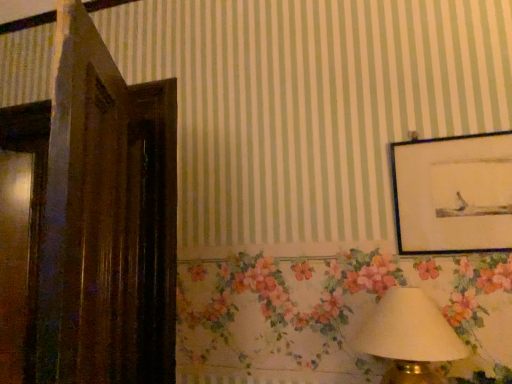
Question: Considering the relative positions of matte black picture frame at upper right and white fabric lampshade at lower right in the image provided, is matte black picture frame at upper right to the left or to the right of white fabric lampshade at lower right?

Choices:
 (A) right
 (B) left

Answer: (A)

Question: Considering the positions of matte black picture frame at upper right and white fabric lampshade at lower right in the image, is matte black picture frame at upper right wider or thinner than white fabric lampshade at lower right?

Choices:
 (A) wide
 (B) thin

Answer: (B)

Question: Choose the correct answer: Is matte black picture frame at upper right inside white fabric lampshade at lower right or outside it?

Choices:
 (A) outside
 (B) inside

Answer: (A)

Question: Looking at their shapes, would you say white fabric lampshade at lower right is wider or thinner than matte black picture frame at upper right?

Choices:
 (A) thin
 (B) wide

Answer: (B)

Question: From the image's perspective, is white fabric lampshade at lower right above or below matte black picture frame at upper right?

Choices:
 (A) above
 (B) below

Answer: (B)

Question: Relative to matte black picture frame at upper right, is white fabric lampshade at lower right in front or behind?

Choices:
 (A) front
 (B) behind

Answer: (A)

Question: Is white fabric lampshade at lower right taller or shorter than matte black picture frame at upper right?

Choices:
 (A) tall
 (B) short

Answer: (B)